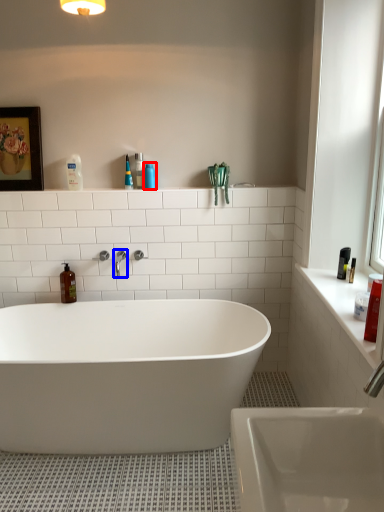
Question: Among these objects, which one is nearest to the camera, cleaning product (highlighted by a red box) or tap (highlighted by a blue box)?

Choices:
 (A) cleaning product
 (B) tap

Answer: (B)